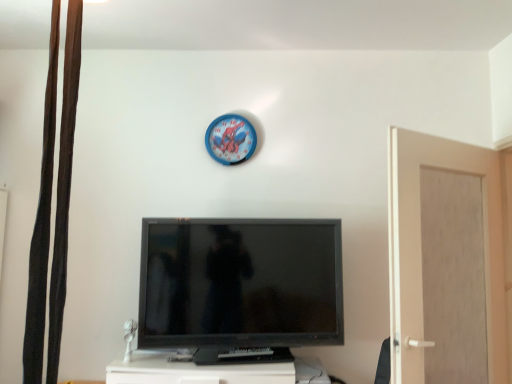
Question: Is blue plastic clock at upper center inside black glossy television at center?

Choices:
 (A) no
 (B) yes

Answer: (A)

Question: Does black glossy television at center lie in front of blue plastic clock at upper center?

Choices:
 (A) no
 (B) yes

Answer: (B)

Question: Are black glossy television at center and blue plastic clock at upper center beside each other?

Choices:
 (A) no
 (B) yes

Answer: (A)

Question: Considering the relative sizes of black glossy television at center and blue plastic clock at upper center in the image provided, is black glossy television at center taller than blue plastic clock at upper center?

Choices:
 (A) no
 (B) yes

Answer: (B)

Question: Considering the relative sizes of black glossy television at center and blue plastic clock at upper center in the image provided, is black glossy television at center wider than blue plastic clock at upper center?

Choices:
 (A) yes
 (B) no

Answer: (A)

Question: From a real-world perspective, relative to beige matte door at right, is black glossy television at center vertically above or below?

Choices:
 (A) above
 (B) below

Answer: (B)

Question: From the image's perspective, is black glossy television at center above or below beige matte door at right?

Choices:
 (A) above
 (B) below

Answer: (B)

Question: Is black glossy television at center in front of or behind beige matte door at right in the image?

Choices:
 (A) front
 (B) behind

Answer: (B)

Question: Is point (268, 322) positioned closer to the camera than point (432, 183)?

Choices:
 (A) closer
 (B) farther

Answer: (A)

Question: From a real-world perspective, is black fabric curtain at left physically located above or below beige matte door at right?

Choices:
 (A) below
 (B) above

Answer: (B)

Question: From the image's perspective, is black fabric curtain at left positioned above or below beige matte door at right?

Choices:
 (A) below
 (B) above

Answer: (B)

Question: Is black fabric curtain at left inside the boundaries of beige matte door at right, or outside?

Choices:
 (A) inside
 (B) outside

Answer: (B)

Question: Visually, is black fabric curtain at left positioned to the left or to the right of beige matte door at right?

Choices:
 (A) right
 (B) left

Answer: (B)

Question: Is point (54, 66) positioned closer to the camera than point (199, 231)?

Choices:
 (A) farther
 (B) closer

Answer: (B)

Question: Relative to black glossy television at center, is black fabric curtain at left in front or behind?

Choices:
 (A) behind
 (B) front

Answer: (B)